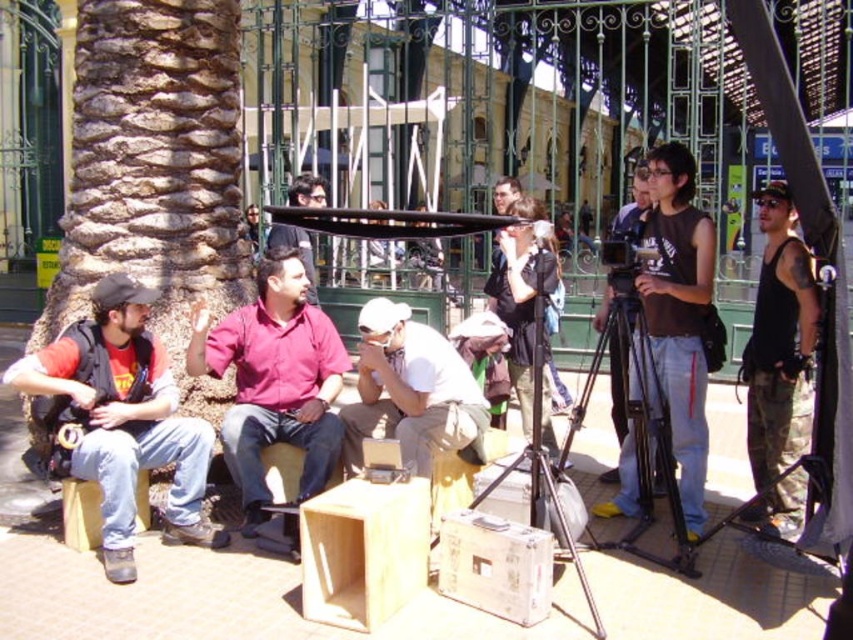
Is point (762, 364) more distant than point (294, 227)?

Yes.

Can you confirm if black tank top at right is shorter than matte pink shirt at center?

In fact, black tank top at right may be taller than matte pink shirt at center.

Between point (807, 420) and point (297, 232), which one is positioned behind?

The point (297, 232) is more distant.

This screenshot has height=640, width=853. I want to click on black tank top at right, so click(779, 342).

Who is lower down, matte black backpack at left or matte pink shirt at center?

matte black backpack at left is lower down.

Between point (128, 509) and point (297, 188), which one is positioned in front?

Point (128, 509) is more forward.

Image resolution: width=853 pixels, height=640 pixels. What do you see at coordinates (120, 417) in the screenshot?
I see `matte black backpack at left` at bounding box center [120, 417].

The width and height of the screenshot is (853, 640). In order to click on matte black backpack at left in this screenshot , I will do `click(120, 417)`.

Is point (99, 408) positioned behind point (659, 557)?

No, (99, 408) is in front of (659, 557).

Is point (57, 340) positioned in front of point (660, 564)?

No, it is not.

Describe the element at coordinates (120, 417) in the screenshot. This screenshot has height=640, width=853. I see `matte black backpack at left` at that location.

Where is `matte black backpack at left`? The image size is (853, 640). matte black backpack at left is located at coordinates (120, 417).